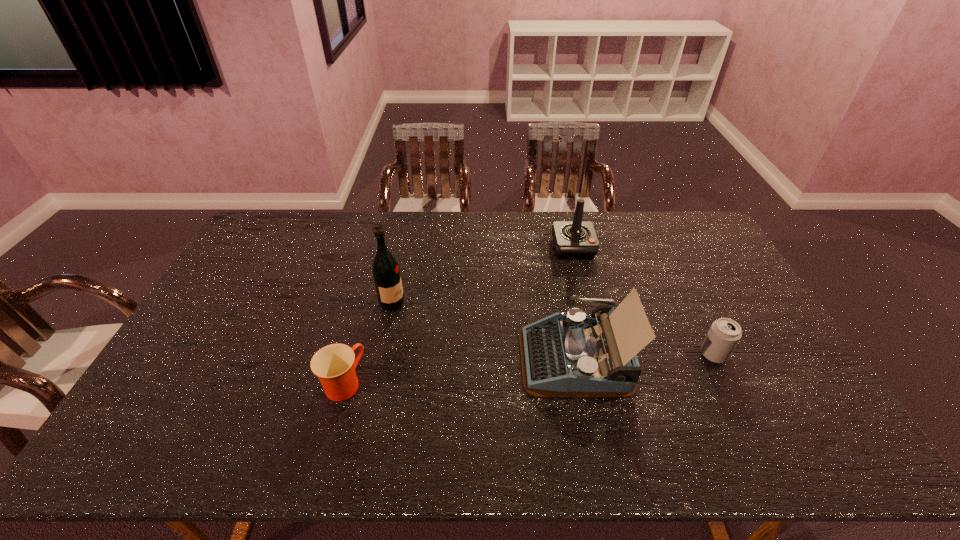
At what (x,y) coordinates should I click in order to perform the action: click on free space that is in between the tallest object and the typewriter. Please return your answer as a coordinate pair (x, y). Looking at the image, I should click on (484, 330).

You are a GUI agent. You are given a task and a screenshot of the screen. Output one action in this format:
    pyautogui.click(x=<x>, y=<y>)
    Task: Click on the vacant area between the farthest object and the cup
    
    Given the screenshot: What is the action you would take?
    pyautogui.click(x=458, y=315)

Where is `free space between the tallest object and the typewriter`? This screenshot has height=540, width=960. free space between the tallest object and the typewriter is located at coordinates point(484,330).

Where is `vacant space in between the joystick and the can`? vacant space in between the joystick and the can is located at coordinates (643, 301).

I want to click on free space between the second farthest object and the joystick, so click(x=483, y=275).

The image size is (960, 540). Identify the location of empty location between the joystick and the typewriter. (574, 302).

Locate an element on the screen. Image resolution: width=960 pixels, height=540 pixels. free space between the rightmost object and the joystick is located at coordinates (643, 301).

At what (x,y) coordinates should I click in order to perform the action: click on unoccupied area between the tallest object and the typewriter. Please return your answer as a coordinate pair (x, y). The height and width of the screenshot is (540, 960). Looking at the image, I should click on (484, 330).

Image resolution: width=960 pixels, height=540 pixels. What are the coordinates of `object that is the fourth closest one to the tallest object` in the screenshot? It's located at (724, 334).

Locate an element on the screen. The image size is (960, 540). object that is the closest to the can is located at coordinates (565, 355).